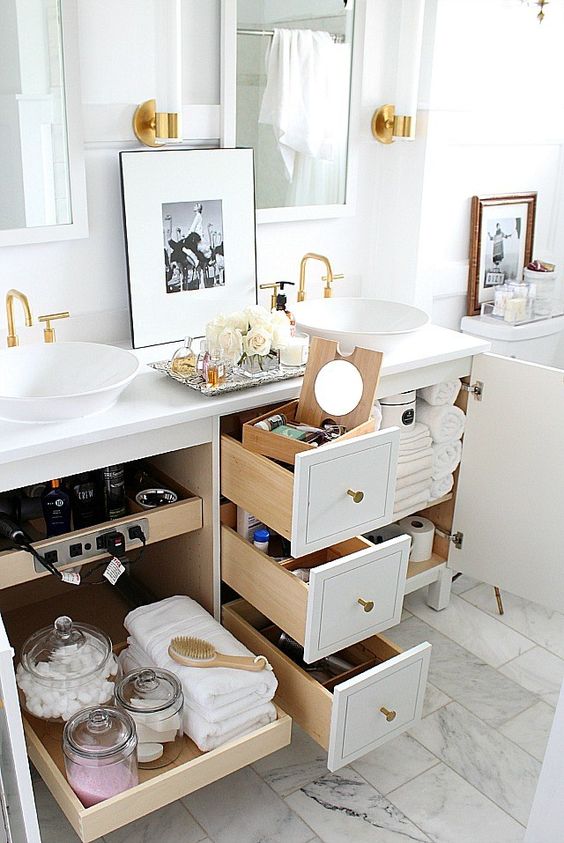
Image resolution: width=564 pixels, height=843 pixels. I want to click on towels, so click(214, 690), click(415, 457), click(440, 395), click(439, 484), click(446, 454), click(444, 427), click(301, 76), click(222, 726).